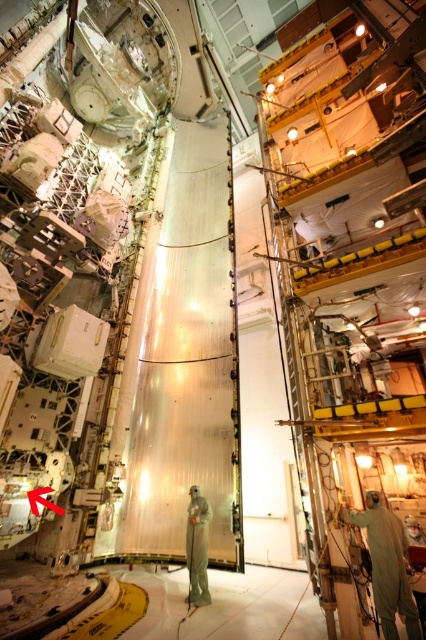
Question: Which object appears closest to the camera in this image?

Choices:
 (A) light gray fabric suit at center
 (B) light green hazmat suit at right

Answer: (B)

Question: Considering the relative positions of light green hazmat suit at right and light gray fabric suit at center in the image provided, where is light green hazmat suit at right located with respect to light gray fabric suit at center?

Choices:
 (A) left
 (B) right

Answer: (B)

Question: Where is light green hazmat suit at right located in relation to light gray fabric suit at center in the image?

Choices:
 (A) left
 (B) right

Answer: (B)

Question: Which point is closer to the camera?

Choices:
 (A) light green hazmat suit at right
 (B) light gray fabric suit at center

Answer: (A)

Question: Among these points, which one is farthest from the camera?

Choices:
 (A) (408, 596)
 (B) (189, 556)

Answer: (B)

Question: Is light green hazmat suit at right below light gray fabric suit at center?

Choices:
 (A) no
 (B) yes

Answer: (A)